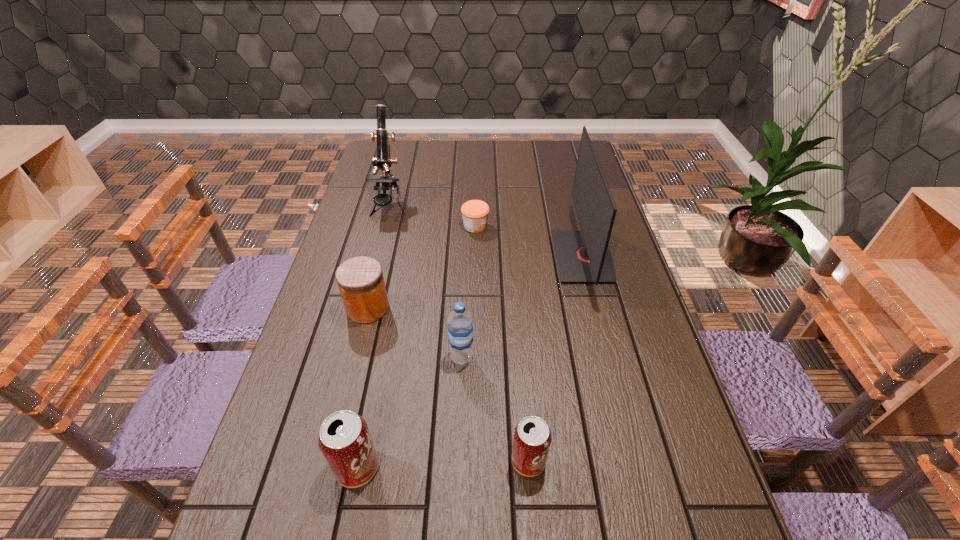
In the current image, all soda cans are evenly spaced. To maintain this equal spacing, where should an additional soda can be placed on the right? Please point out a free spot. Please provide its 2D coordinates. Your answer should be formatted as a tuple, i.e. [(x, y)], where the tuple contains the x and y coordinates of a point satisfying the conditions above.

[(696, 455)]